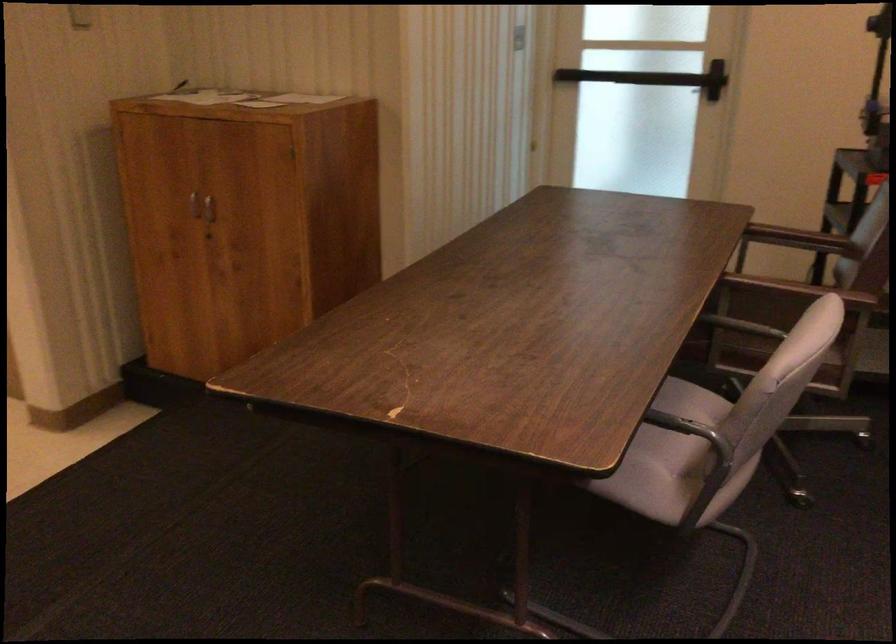
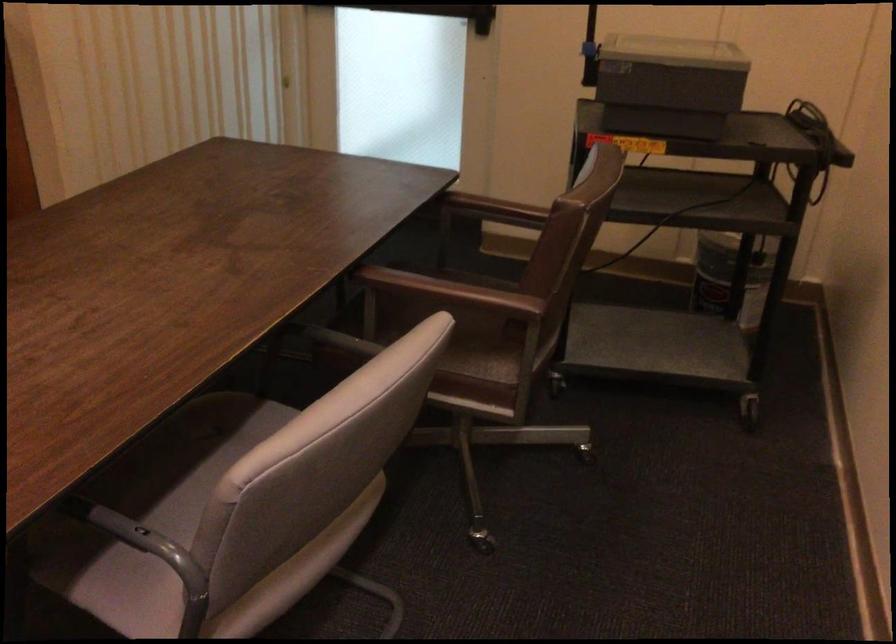
In the second image, find the point that corresponds to [673,84] in the first image.

(437, 12)